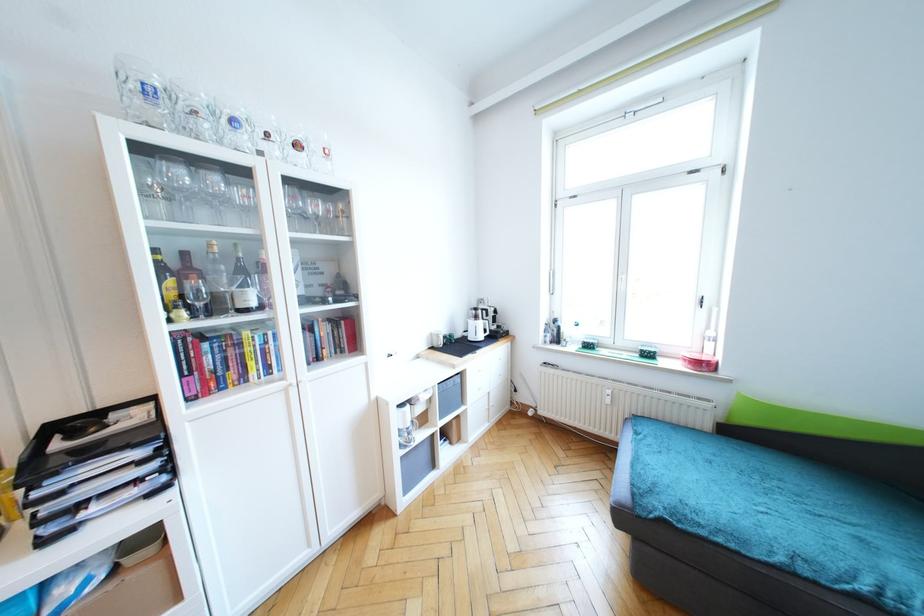
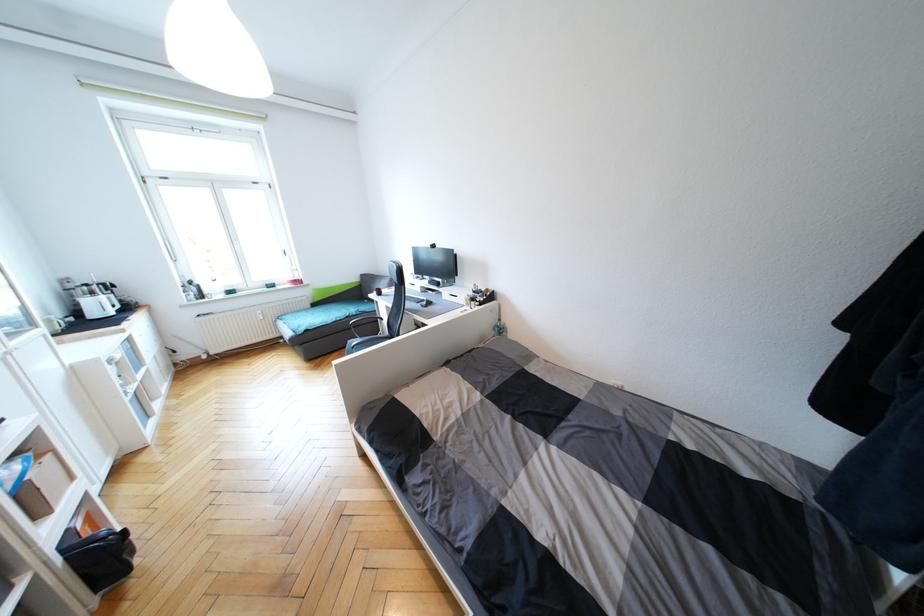
Locate, in the second image, the point that corresponds to pixel 480 318 in the first image.

(95, 294)